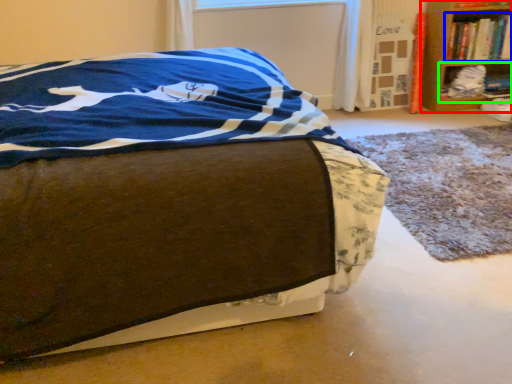
Question: Which is farther away from shelf (highlighted by a red box)? book (highlighted by a blue box) or shelf (highlighted by a green box)?

Choices:
 (A) book
 (B) shelf

Answer: (B)